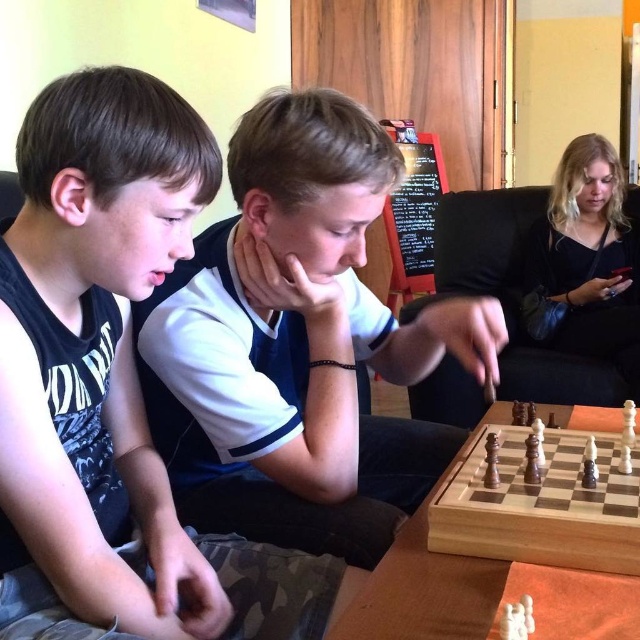
You are a photographer standing in front of the chessboard. You need to take a photo that includes both the black matte shirt at left and the white matte shirt at center. Which shirt should you position closer to the camera to ensure both are fully visible in the frame?

The black matte shirt at left is located above the white matte shirt at center, so positioning the camera closer to the black matte shirt at left will help ensure both are fully visible in the frame.

You are a photographer standing in front of the chessboard. You want to take a photo that includes both the white matte shirt at center and the light wood chess set at center. Which object will appear larger in the photo?

The white matte shirt at center will appear larger in the photo because it has a greater height compared to the light wood chess set at center.

You are a chess piece that is 1.5 inches wide. You are currently on the chessboard and want to move from the black matte shirt at left to the white matte shirt at center. Is there enough space between them for you to pass through?

The black matte shirt at left and white matte shirt at center are 8.98 inches apart from each other, so yes, the chess piece can move between them since the distance is greater than the piece width of 1.5 inches.